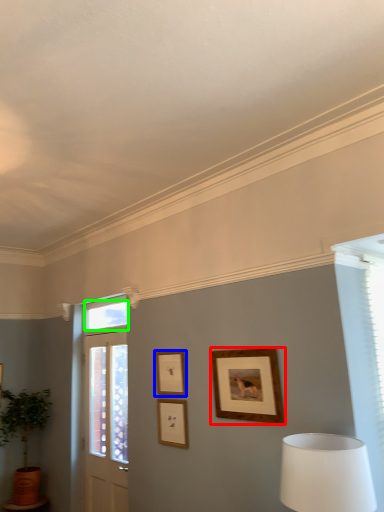
Question: Based on their relative distances, which object is farther from picture frame (highlighted by a red box)? Choose from picture frame (highlighted by a blue box) and window (highlighted by a green box).

Choices:
 (A) picture frame
 (B) window

Answer: (B)